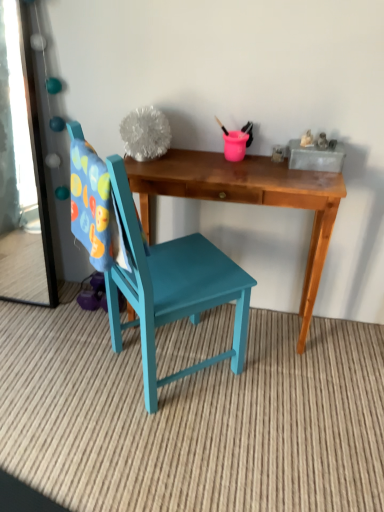
Identify the location of vacant area situated to the left side of wooden desk at center. This screenshot has height=512, width=384. (67, 349).